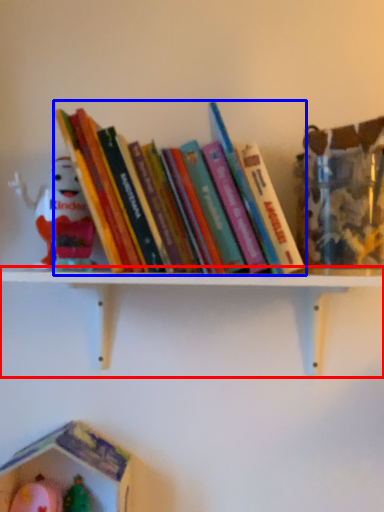
Question: Which point is further to the camera, shelf (highlighted by a red box) or book (highlighted by a blue box)?

Choices:
 (A) shelf
 (B) book

Answer: (A)